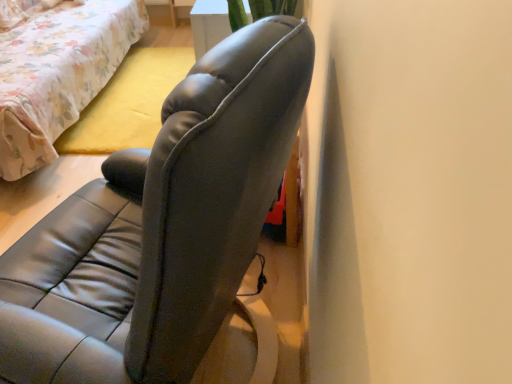
What is the approximate width of floral fabric bed at upper left?

floral fabric bed at upper left is 3.71 feet wide.

Image resolution: width=512 pixels, height=384 pixels. What do you see at coordinates (58, 74) in the screenshot?
I see `floral fabric bed at upper left` at bounding box center [58, 74].

Find the location of a particular element. floral fabric bed at upper left is located at coordinates (58, 74).

You are a GUI agent. You are given a task and a screenshot of the screen. Output one action in this format:
    pyautogui.click(x=<x>, y=<y>)
    Task: Click on the leather-like gray chair at center
    The width and height of the screenshot is (512, 384).
    Given the screenshot: What is the action you would take?
    pyautogui.click(x=166, y=235)

This screenshot has width=512, height=384. What do you see at coordinates (166, 235) in the screenshot?
I see `leather-like gray chair at center` at bounding box center [166, 235].

Locate an element on the screen. The height and width of the screenshot is (384, 512). floral fabric bed at upper left is located at coordinates (58, 74).

Considering the relative positions of floral fabric bed at upper left and leather-like gray chair at center in the image provided, is floral fabric bed at upper left to the left or to the right of leather-like gray chair at center?

In the image, floral fabric bed at upper left appears on the left side of leather-like gray chair at center.

Which object is closer to the camera, floral fabric bed at upper left or leather-like gray chair at center?

leather-like gray chair at center is closer to the camera.

Considering the points (44, 31) and (183, 339), which point is behind, point (44, 31) or point (183, 339)?

The point (44, 31) is farther.

From the image's perspective, who appears lower, floral fabric bed at upper left or leather-like gray chair at center?

leather-like gray chair at center is shown below in the image.

From a real-world perspective, is floral fabric bed at upper left physically located above or below leather-like gray chair at center?

In terms of real-world spatial position, floral fabric bed at upper left is below leather-like gray chair at center.

Between floral fabric bed at upper left and leather-like gray chair at center, which one has smaller width?

leather-like gray chair at center.

Considering the sizes of objects floral fabric bed at upper left and leather-like gray chair at center in the image provided, who is shorter, floral fabric bed at upper left or leather-like gray chair at center?

floral fabric bed at upper left is shorter.

Between floral fabric bed at upper left and leather-like gray chair at center, which one has smaller size?

leather-like gray chair at center.

Is floral fabric bed at upper left inside the boundaries of leather-like gray chair at center, or outside?

floral fabric bed at upper left is not enclosed by leather-like gray chair at center.

Are floral fabric bed at upper left and leather-like gray chair at center far apart?

Absolutely, floral fabric bed at upper left is distant from leather-like gray chair at center.

Is floral fabric bed at upper left facing away from leather-like gray chair at center?

No, floral fabric bed at upper left is not facing away from leather-like gray chair at center.

How different are the orientations of floral fabric bed at upper left and leather-like gray chair at center in degrees?

164 degrees.

Where is `chair located on the right of floral fabric bed at upper left`? chair located on the right of floral fabric bed at upper left is located at coordinates (166, 235).

Looking at this image, considering the positions of objects leather-like gray chair at center and floral fabric bed at upper left in the image provided, who is more to the right, leather-like gray chair at center or floral fabric bed at upper left?

Positioned to the right is leather-like gray chair at center.

Is leather-like gray chair at center in front of or behind floral fabric bed at upper left in the image?

leather-like gray chair at center is positioned closer to the viewer than floral fabric bed at upper left.

Does point (97, 192) lie in front of point (96, 4)?

Yes, it is in front of point (96, 4).

From the image's perspective, is leather-like gray chair at center beneath floral fabric bed at upper left?

Indeed, from the image's perspective, leather-like gray chair at center is shown beneath floral fabric bed at upper left.

Based on the photo, from a real-world perspective, which is physically below, leather-like gray chair at center or floral fabric bed at upper left?

In real-world perspective, floral fabric bed at upper left is lower.

Looking at their sizes, would you say leather-like gray chair at center is wider or thinner than floral fabric bed at upper left?

leather-like gray chair at center is thinner than floral fabric bed at upper left.

Who is taller, leather-like gray chair at center or floral fabric bed at upper left?

leather-like gray chair at center.

Is leather-like gray chair at center bigger than floral fabric bed at upper left?

Incorrect, leather-like gray chair at center is not larger than floral fabric bed at upper left.

Would you say floral fabric bed at upper left is part of leather-like gray chair at center's contents?

Definitely not — floral fabric bed at upper left is not inside leather-like gray chair at center.

Are leather-like gray chair at center and floral fabric bed at upper left located far from each other?

Yes, leather-like gray chair at center and floral fabric bed at upper left are located far from each other.

Could you tell me if leather-like gray chair at center is facing floral fabric bed at upper left?

No, leather-like gray chair at center is not facing towards floral fabric bed at upper left.

What's the angular difference between leather-like gray chair at center and floral fabric bed at upper left's facing directions?

The angle between the facing direction of leather-like gray chair at center and the facing direction of floral fabric bed at upper left is 164 degrees.

The width and height of the screenshot is (512, 384). Identify the location of bed that is on the left side of leather-like gray chair at center. (58, 74).

Locate an element on the screen. This screenshot has width=512, height=384. bed located behind the leather-like gray chair at center is located at coordinates (58, 74).

This screenshot has height=384, width=512. Find the location of `bed above the leather-like gray chair at center (from the image's perspective)`. bed above the leather-like gray chair at center (from the image's perspective) is located at coordinates (58, 74).